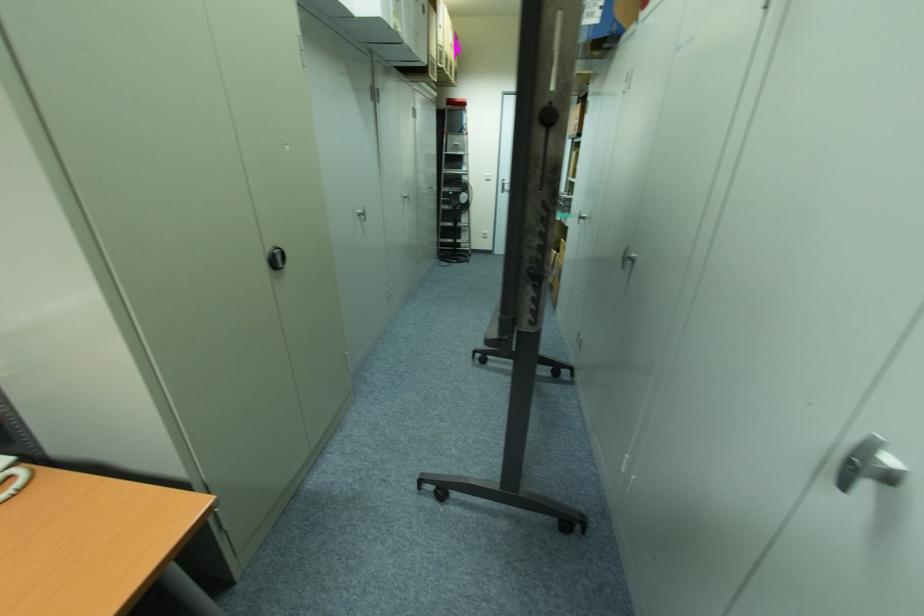
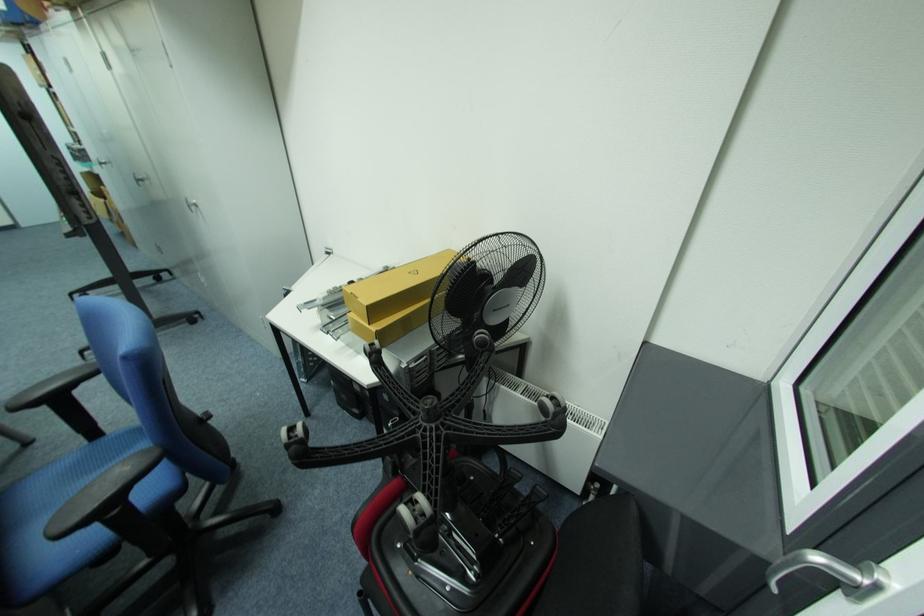
Locate, in the second image, the point that corresponds to pixel 586 219 in the first image.

(105, 164)